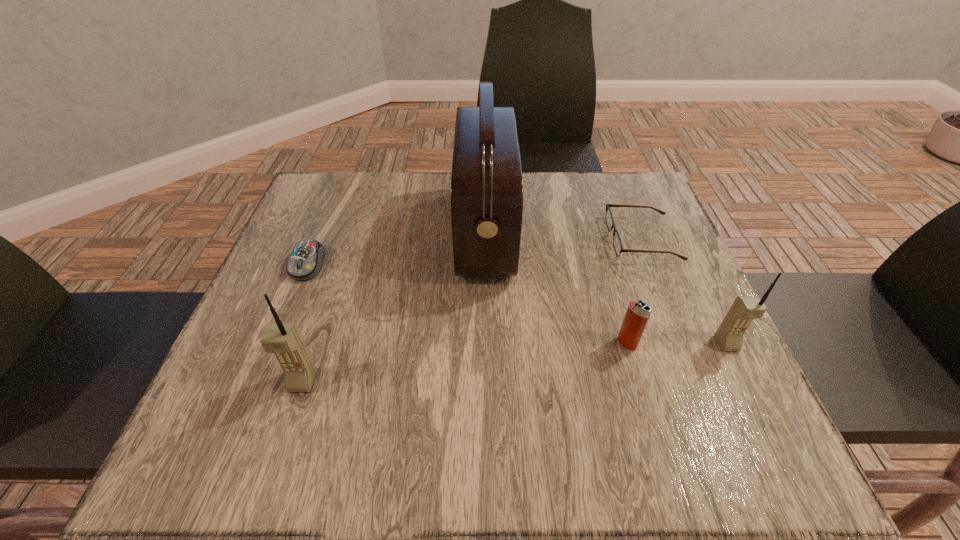
The image size is (960, 540). What are the coordinates of `empty space between the third object from left to right and the fourth object from left to right` in the screenshot? It's located at (556, 288).

Locate an element on the screen. This screenshot has height=540, width=960. unoccupied position between the leftmost object and the farther cellular telephone is located at coordinates (517, 304).

This screenshot has width=960, height=540. Identify the location of free space between the radio receiver and the farther cellular telephone. (606, 288).

You are a GUI agent. You are given a task and a screenshot of the screen. Output one action in this format:
    pyautogui.click(x=<x>, y=<y>)
    Task: Click on the vacant area between the nearest object and the computer mouse
    
    Given the screenshot: What is the action you would take?
    pyautogui.click(x=305, y=323)

The height and width of the screenshot is (540, 960). In order to click on vacant space that's between the tallest object and the spectacles in this screenshot , I will do [564, 235].

Image resolution: width=960 pixels, height=540 pixels. I want to click on free space that is in between the fourth shortest object and the radio receiver, so click(606, 288).

You are a GUI agent. You are given a task and a screenshot of the screen. Output one action in this format:
    pyautogui.click(x=<x>, y=<y>)
    Task: Click on the unoccupied area between the spectacles and the igniter
    The image size is (960, 540).
    Given the screenshot: What is the action you would take?
    pyautogui.click(x=635, y=291)

The image size is (960, 540). Identify the location of object that is the fourth closest one to the taller cellular telephone. (617, 242).

This screenshot has width=960, height=540. What are the coordinates of `object that can be found as the fourth closest to the spectacles` in the screenshot? It's located at (305, 262).

Find the location of a particular element. vacant space that satisfies the following two spatial constraints: 1. on the front panel of the tallest object; 2. on the left side of the igniter is located at coordinates (486, 343).